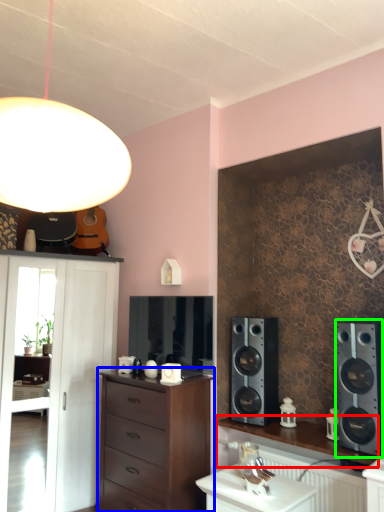
Question: Estimate the real-world distances between objects in this image. Which object is closer to desk (highlighted by a red box), chest of drawers (highlighted by a blue box) or speaker (highlighted by a green box)?

Choices:
 (A) chest of drawers
 (B) speaker

Answer: (B)